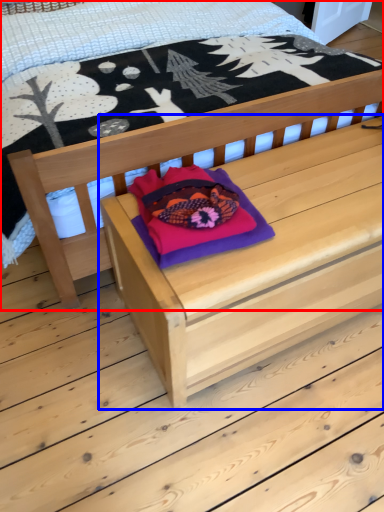
Question: Among these objects, which one is farthest to the camera, bed (highlighted by a red box) or table (highlighted by a blue box)?

Choices:
 (A) bed
 (B) table

Answer: (B)